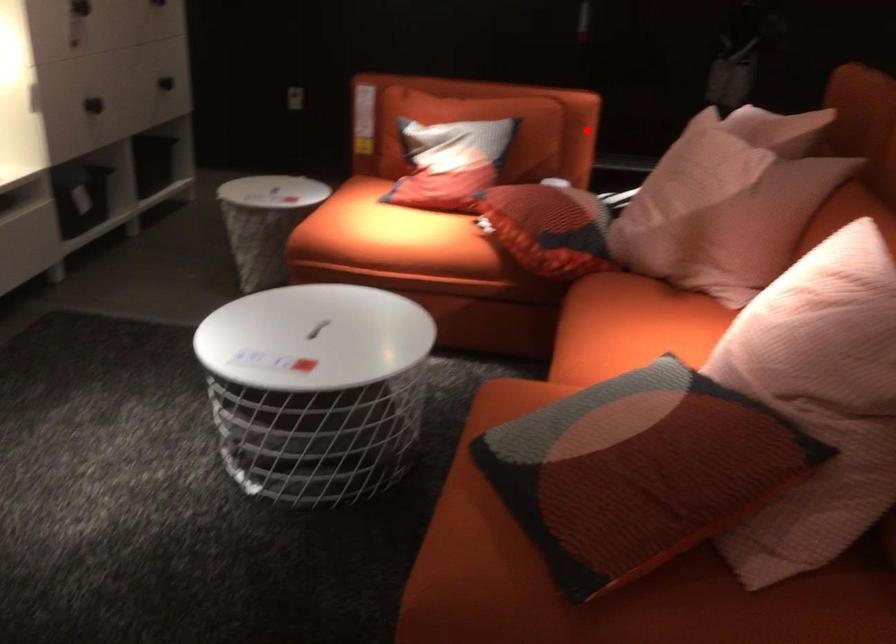
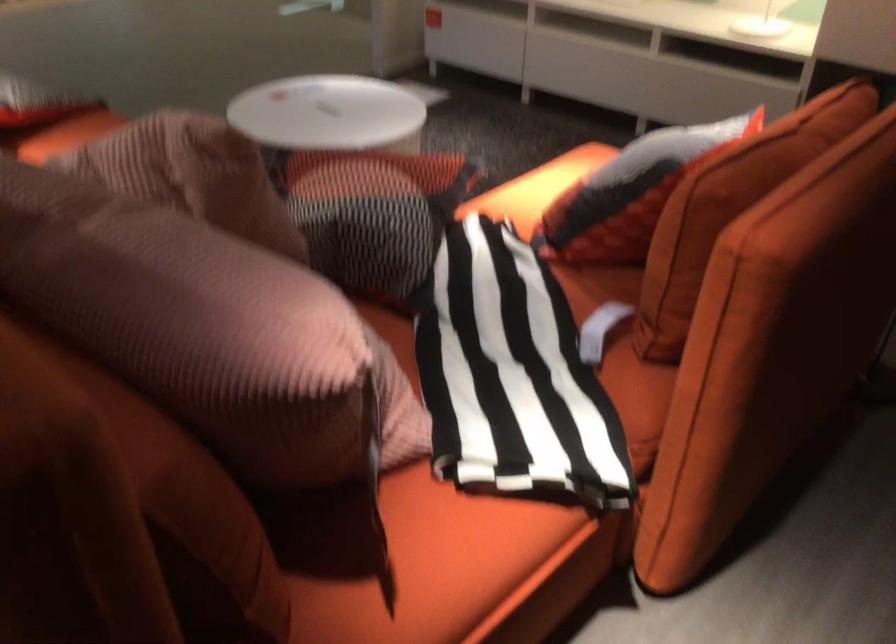
The point at the highlighted location is marked in the first image. Where is the corresponding point in the second image?

(771, 346)